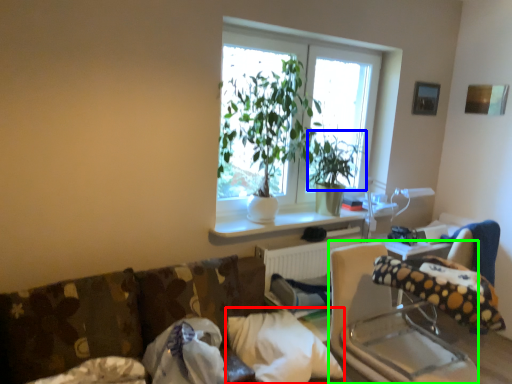
Question: Which object is the closest to the pillow (highlighted by a red box)? Choose among these: plant (highlighted by a blue box) or rocking chair (highlighted by a green box).

Choices:
 (A) plant
 (B) rocking chair

Answer: (B)